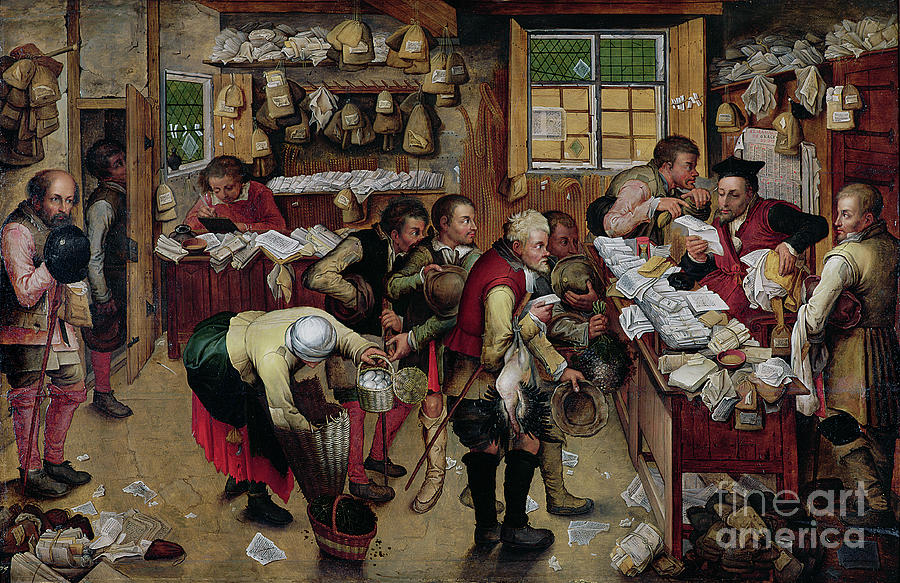
Locate an element on the screen. 1 desk is located at coordinates (672, 417).